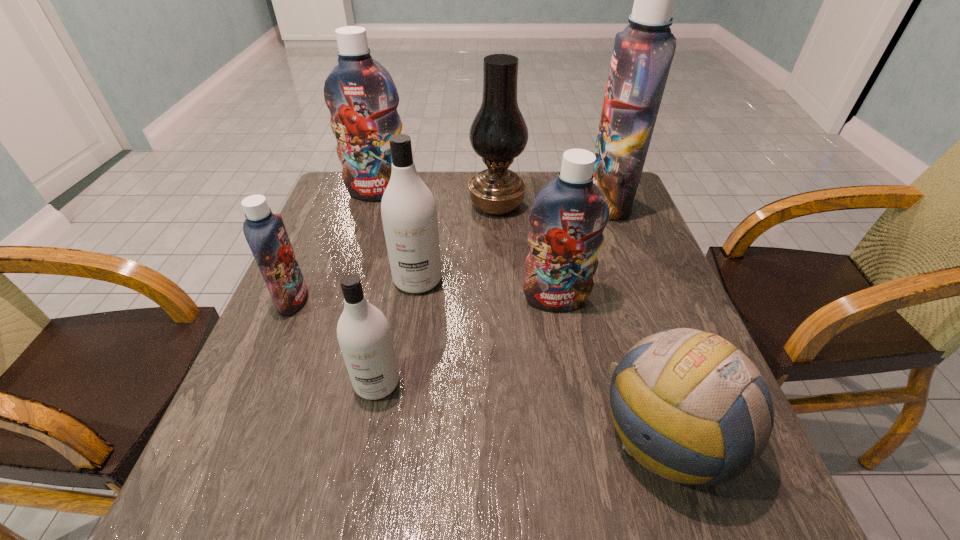
Locate an element on the screen. This screenshot has height=540, width=960. vacant space at the left edge is located at coordinates (308, 269).

Identify the location of vacant space at the right edge of the desktop. The height and width of the screenshot is (540, 960). (607, 274).

At what (x,y) coordinates should I click in order to perform the action: click on vacant area at the near left corner of the desktop. Please return your answer as a coordinate pair (x, y). Looking at the image, I should click on (208, 518).

The height and width of the screenshot is (540, 960). I want to click on empty location between the bigger white shampoo and the third biggest blue shampoo, so click(487, 289).

Locate an element on the screen. This screenshot has width=960, height=540. vacant space that's between the third smallest blue shampoo and the third biggest blue shampoo is located at coordinates (468, 246).

Find the location of a particular element. vacant space in between the bigger white shampoo and the rightmost shampoo is located at coordinates (514, 240).

The width and height of the screenshot is (960, 540). Identify the location of vacant space that's between the nearest shampoo and the shortest object. (522, 409).

Locate an element on the screen. The width and height of the screenshot is (960, 540). vacant area between the smaller white shampoo and the oil lamp is located at coordinates (437, 294).

Identify the location of empty space between the nearest shampoo and the second tallest shampoo. (377, 288).

Identify the location of vacant area that lies between the bigger white shampoo and the rightmost shampoo. This screenshot has height=540, width=960. (514, 240).